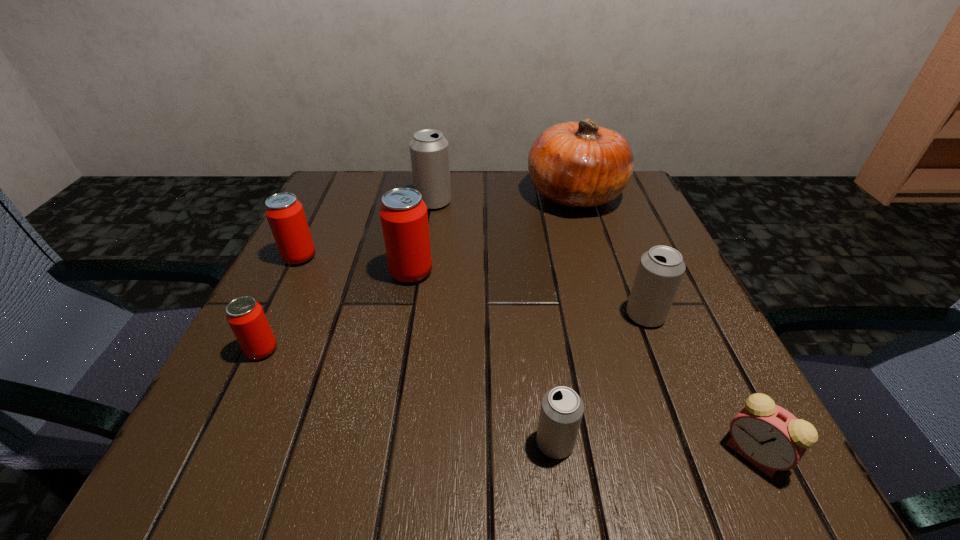
I want to click on object that is at the near right corner, so click(x=771, y=438).

Find the location of a particular element. Image resolution: width=960 pixels, height=540 pixels. free space at the far edge of the desktop is located at coordinates (499, 220).

This screenshot has height=540, width=960. What are the coordinates of `free region at the near edge of the desktop` in the screenshot? It's located at (529, 448).

Find the location of `vacant space at the left edge of the desktop`. vacant space at the left edge of the desktop is located at coordinates (324, 240).

The image size is (960, 540). In the image, there is a desktop. Identify the location of free space at the right edge. (655, 237).

At what (x,y) coordinates should I click in order to perform the action: click on free space at the far left corner of the desktop. Please return your answer as a coordinate pair (x, y). The width and height of the screenshot is (960, 540). Looking at the image, I should click on (330, 212).

This screenshot has width=960, height=540. What are the coordinates of `free space between the second biggest red beer can and the fourth nearest object` in the screenshot? It's located at (472, 286).

Identify the location of free space that is in between the nearest white beer can and the farthest white beer can. (494, 322).

You are a GUI agent. You are given a task and a screenshot of the screen. Output one action in this format:
    pyautogui.click(x=<x>, y=<y>)
    Task: Click on the free space between the pink alarm clock and the second smallest red beer can
    The height and width of the screenshot is (540, 960).
    Given the screenshot: What is the action you would take?
    pyautogui.click(x=526, y=355)

You are a GUI agent. You are given a task and a screenshot of the screen. Output one action in this format:
    pyautogui.click(x=<x>, y=<y>)
    Task: Click on the free space that is in between the farthest white beer can and the pumpkin
    
    Given the screenshot: What is the action you would take?
    pyautogui.click(x=504, y=199)